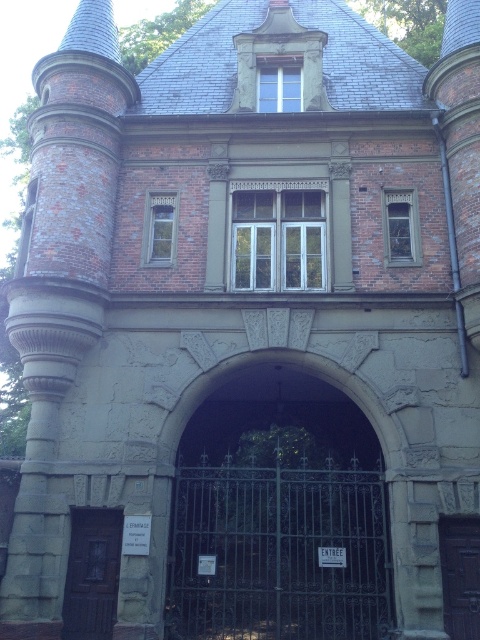
Is brown wooden door at lower left above dark brown wooden door at center?

Incorrect, brown wooden door at lower left is not positioned above dark brown wooden door at center.

This screenshot has height=640, width=480. I want to click on brown wooden door at lower left, so click(92, 573).

Who is lower down, dark gray wrought iron gate at center or dark brown wooden door at center?

dark brown wooden door at center is below.

Does dark gray wrought iron gate at center appear on the left side of dark brown wooden door at center?

Correct, you'll find dark gray wrought iron gate at center to the left of dark brown wooden door at center.

Between point (204, 625) and point (471, 520), which one is positioned in front?

Point (471, 520) is in front.

In order to click on dark gray wrought iron gate at center in this screenshot , I will do `click(278, 515)`.

Measure the distance from dark gray wrought iron gate at center to brown wooden door at lower left.

4.28 meters

Can you confirm if dark gray wrought iron gate at center is positioned above brown wooden door at lower left?

Indeed, dark gray wrought iron gate at center is positioned over brown wooden door at lower left.

Who is more distant from viewer, [288,422] or [64,630]?

The point [288,422] is more distant.

The width and height of the screenshot is (480, 640). What are the coordinates of `dark gray wrought iron gate at center` in the screenshot? It's located at (278, 515).